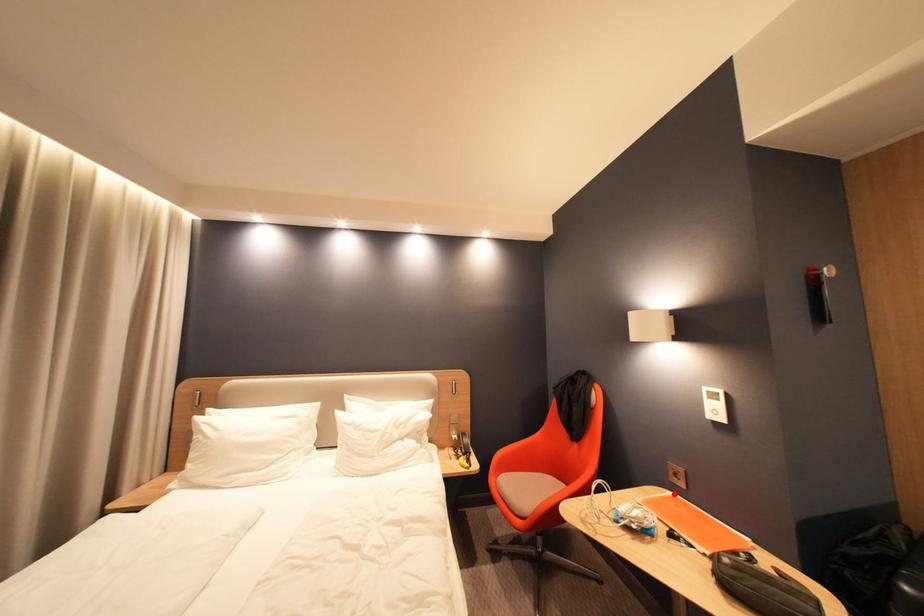
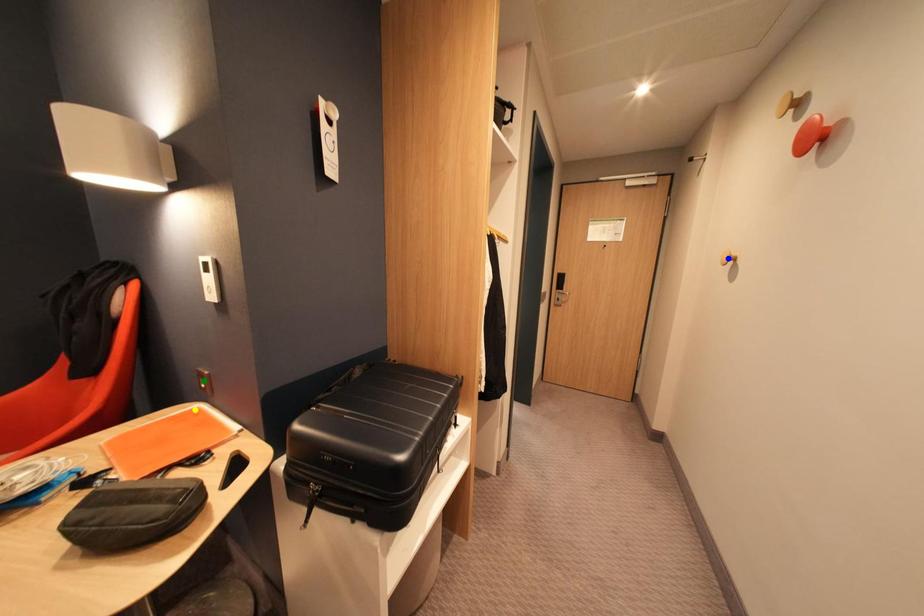
Question: I am providing you with two images of the same scene from different viewpoints. A red point is marked on the first image. You are given multiple points on the second image. In image 2, which mark is for the same physical point as the one in image 1?

Choices:
 (A) blue point
 (B) green point
 (C) yellow point

Answer: (C)